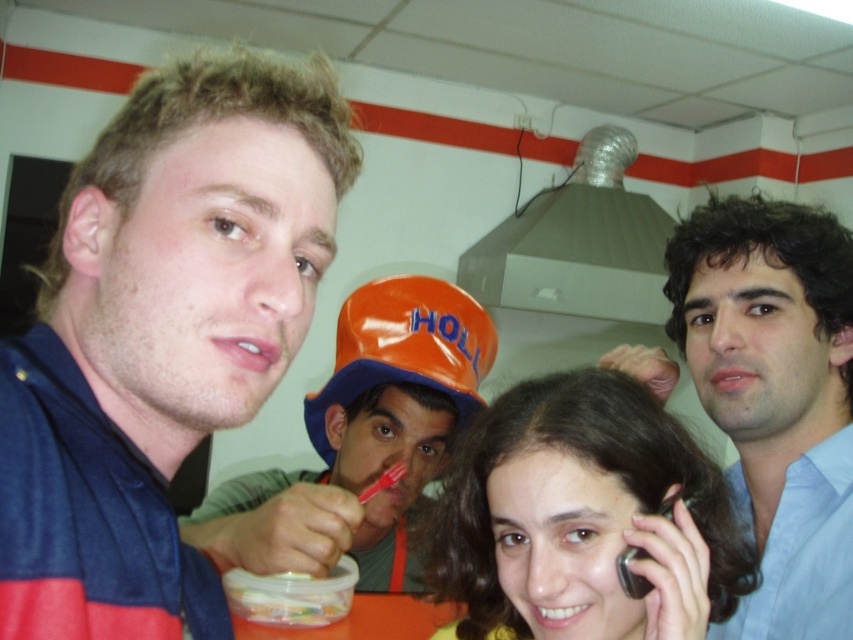
Who is more forward, (276, 310) or (665, 589)?

Point (276, 310) is more forward.

In the scene shown: Does blue fabric shirt at center appear on the right side of matte black phone at center?

In fact, blue fabric shirt at center is to the left of matte black phone at center.

Who is more distant from viewer, (286, 186) or (698, 548)?

The point (698, 548) is more distant.

Find the location of a particular element. The image size is (853, 640). blue fabric shirt at center is located at coordinates 160,336.

Between point (492, 598) and point (808, 435), which one is positioned in front?

Point (492, 598) is in front.

Which is more to the left, matte black phone at center or blue shirt at right?

matte black phone at center is more to the left.

You are a GUI agent. You are given a task and a screenshot of the screen. Output one action in this format:
    pyautogui.click(x=<x>, y=<y>)
    Task: Click on the matte black phone at center
    
    Given the screenshot: What is the action you would take?
    pyautogui.click(x=584, y=516)

Identify the location of matte black phone at center. [x=584, y=516].

Between matte orange hard hat at center and orange plastic baseball hat at center, which one has more height?

With more height is matte orange hard hat at center.

Is point (361, 486) behind point (360, 314)?

Yes, it is.

You are a GUI agent. You are given a task and a screenshot of the screen. Output one action in this format:
    pyautogui.click(x=<x>, y=<y>)
    Task: Click on the matte orange hard hat at center
    This screenshot has height=640, width=853.
    Given the screenshot: What is the action you would take?
    pyautogui.click(x=369, y=432)